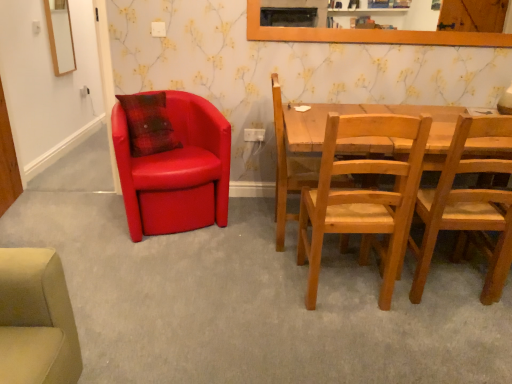
At what (x,y) coordinates should I click in order to perform the action: click on free space in front of light brown wooden chair at right, the fourth chair from the left. Please return your answer as a coordinate pair (x, y). Looking at the image, I should click on (455, 331).